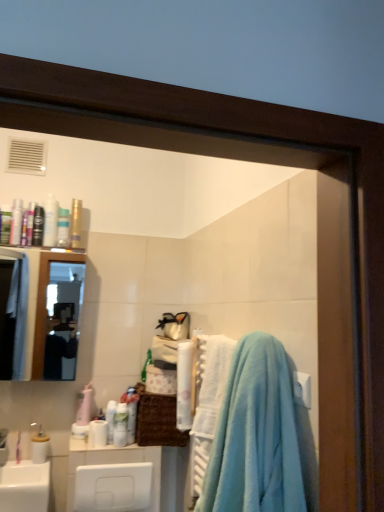
Question: From the image's perspective, is clear glass mirror at upper left located beneath white glossy bottle at center, which ranks as the 1th toiletry in right-to-left order?

Choices:
 (A) no
 (B) yes

Answer: (A)

Question: Considering the relative sizes of clear glass mirror at upper left and white glossy bottle at center, which ranks as the 1th toiletry in right-to-left order, in the image provided, is clear glass mirror at upper left smaller than white glossy bottle at center, which ranks as the 1th toiletry in right-to-left order,?

Choices:
 (A) yes
 (B) no

Answer: (B)

Question: Is clear glass mirror at upper left not within white glossy bottle at center, positioned as the ninth toiletry in left-to-right order?

Choices:
 (A) yes
 (B) no

Answer: (A)

Question: Is clear glass mirror at upper left to the right of white glossy bottle at center, positioned as the ninth toiletry in left-to-right order, from the viewer's perspective?

Choices:
 (A) yes
 (B) no

Answer: (B)

Question: Is white glossy bottle at center, which ranks as the 1th toiletry in right-to-left order, completely or partially inside clear glass mirror at upper left?

Choices:
 (A) yes
 (B) no

Answer: (B)

Question: From the image's perspective, is clear glass mirror at upper left located above white glossy bottle at center, which ranks as the 1th toiletry in right-to-left order?

Choices:
 (A) no
 (B) yes

Answer: (B)

Question: Does light blue plush towel at right have a larger size compared to gold metallic spray can at upper left, which is counted as the third toiletry, starting from the right?

Choices:
 (A) yes
 (B) no

Answer: (A)

Question: From the image's perspective, is light blue plush towel at right on top of gold metallic spray can at upper left, positioned as the seventh toiletry in left-to-right order?

Choices:
 (A) yes
 (B) no

Answer: (B)

Question: Can you confirm if light blue plush towel at right is shorter than gold metallic spray can at upper left, which is counted as the third toiletry, starting from the right?

Choices:
 (A) yes
 (B) no

Answer: (B)

Question: Is light blue plush towel at right not near gold metallic spray can at upper left, which is counted as the third toiletry, starting from the right?

Choices:
 (A) no
 (B) yes

Answer: (B)

Question: From a real-world perspective, is light blue plush towel at right physically above gold metallic spray can at upper left, positioned as the seventh toiletry in left-to-right order?

Choices:
 (A) no
 (B) yes

Answer: (A)

Question: Is gold metallic spray can at upper left, which is counted as the third toiletry, starting from the right, located within light blue plush towel at right?

Choices:
 (A) yes
 (B) no

Answer: (B)

Question: From a real-world perspective, is shiny black tube at upper left, which is counted as the fourth toiletry, starting from the left, physically above white glossy bottle at center, positioned as the ninth toiletry in left-to-right order?

Choices:
 (A) no
 (B) yes

Answer: (B)